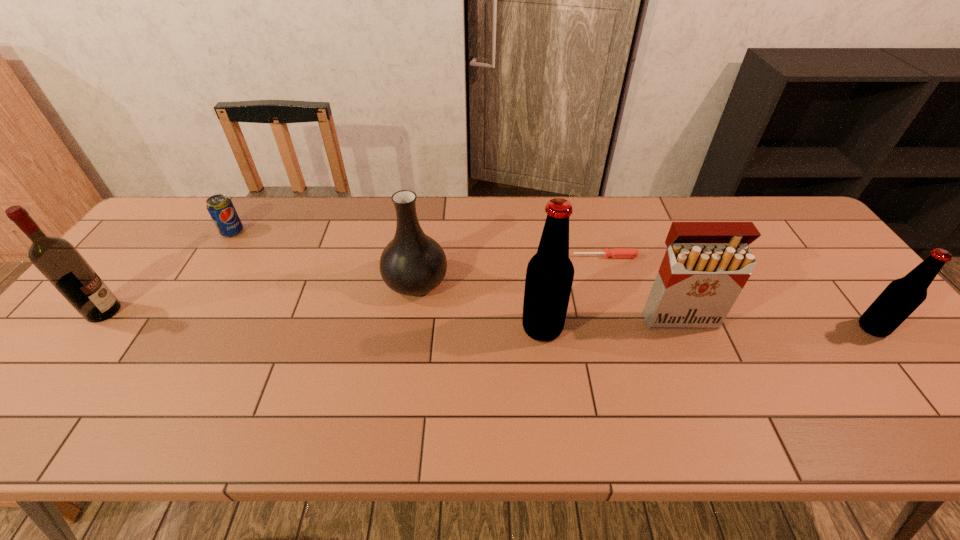
I want to click on the left beer bottle, so click(549, 277).

Find the location of `the taller beer bottle`. the taller beer bottle is located at coordinates (549, 277).

Where is `the rightmost object`? The height and width of the screenshot is (540, 960). the rightmost object is located at coordinates (903, 296).

The height and width of the screenshot is (540, 960). Find the location of `the shorter beer bottle`. the shorter beer bottle is located at coordinates (903, 296).

Where is `the sixth tallest object`? The height and width of the screenshot is (540, 960). the sixth tallest object is located at coordinates (221, 209).

Find the location of a particular element. the farthest object is located at coordinates (221, 209).

Identify the location of the fifth object from right to left. (412, 264).

The image size is (960, 540). In order to click on screwdriver in this screenshot , I will do `click(615, 252)`.

Where is `alcohol`? Image resolution: width=960 pixels, height=540 pixels. alcohol is located at coordinates (58, 260).

Locate an element on the screen. cigarette case is located at coordinates (706, 265).